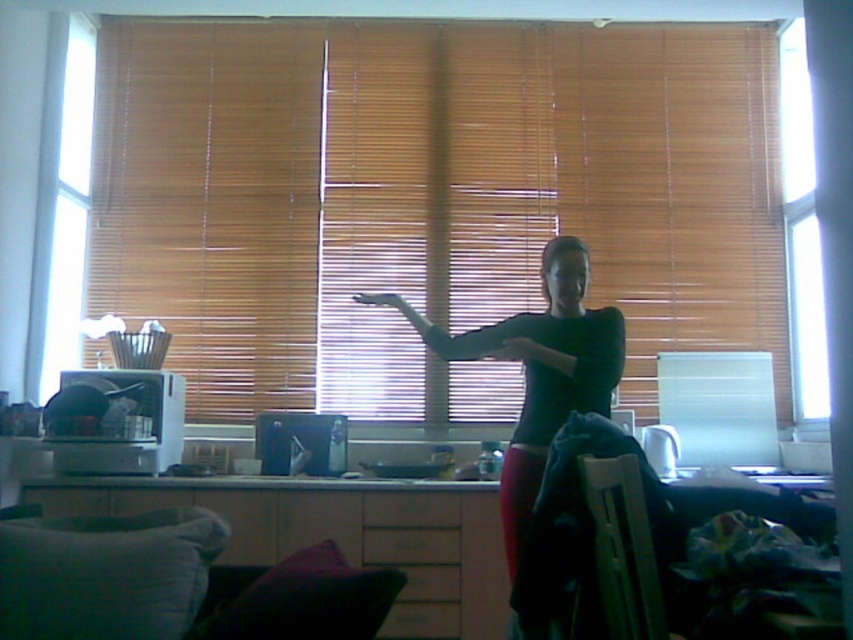
You are a photographer trying to capture the scene through the brown wooden blinds at center and the black matte shirt at center. Which object would appear taller in the photograph?

The brown wooden blinds at center would appear taller in the photograph since they have a greater height compared to the black matte shirt at center.

You are a photographer trying to capture the person in the black matte shirt at center. The brown wooden blinds at center are blocking part of your view. Can you adjust your position to avoid the blinds?

The brown wooden blinds at center is positioned over the black matte shirt at center, so moving your position slightly to the side or adjusting the angle could help avoid the blinds and capture the shirt clearly.

You are a photographer setting up a shoot in the room. You need to decide whether the black matte shirt at center will block the view of the transparent glass window at upper right when placed in the center. Can you determine this based on their sizes?

The black matte shirt at center might be wider than transparent glass window at upper right, so there is a possibility that the shirt could block the window if positioned centrally.